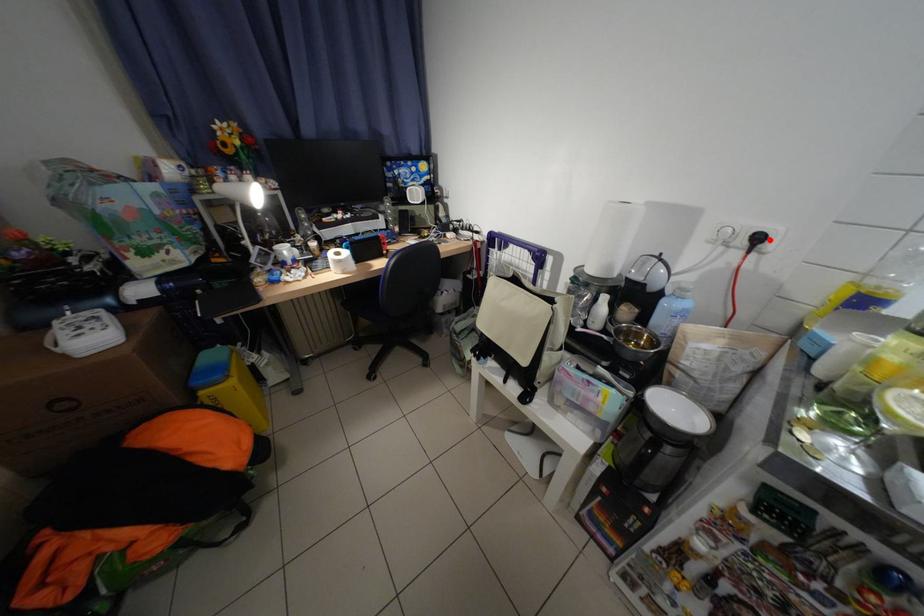
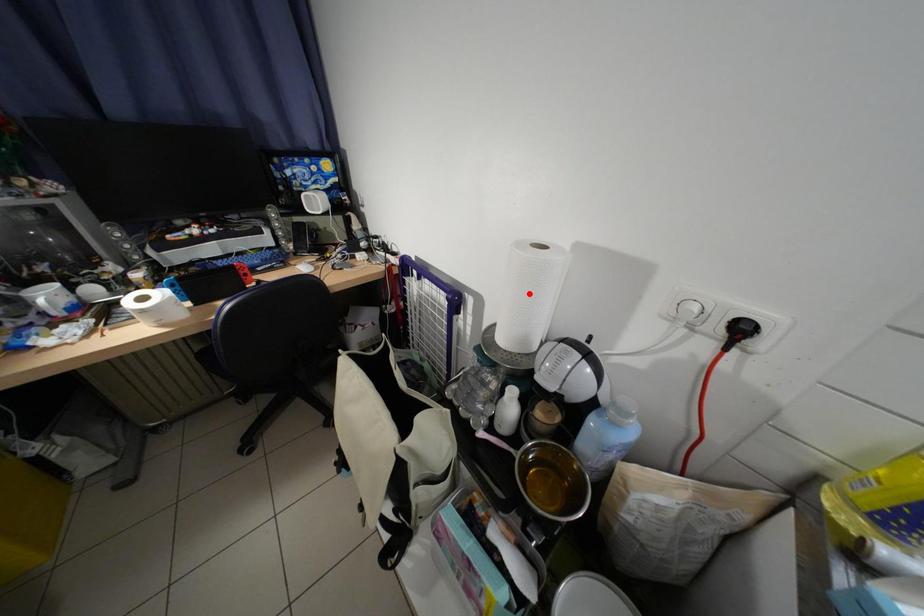
I am providing you with two images of the same scene from different viewpoints. A red point is marked on the first image and another point is marked on the second image. Is the marked point in image1 the same physical position as the marked point in image2?

No